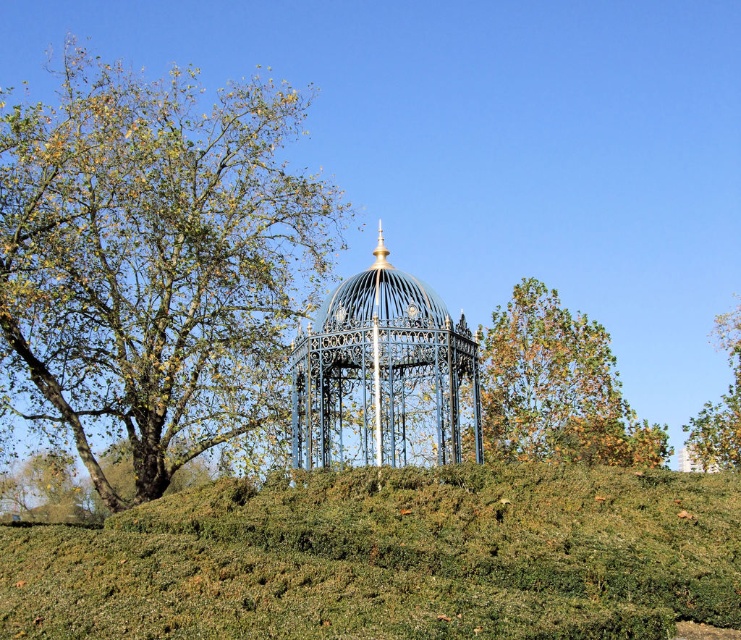
Question: Does green leafy tree at left appear under yellow-green foliage at right?

Choices:
 (A) no
 (B) yes

Answer: (A)

Question: Which is nearer to the yellow-green foliage at right?

Choices:
 (A) green leafy tree at left
 (B) green leafy tree at upper right
 (C) green grassy hill at center
 (D) blue wrought iron gazebo at center

Answer: (D)

Question: Does green leafy tree at left have a greater width compared to blue wrought iron gazebo at center?

Choices:
 (A) no
 (B) yes

Answer: (B)

Question: Considering the real-world distances, which object is farthest from the green leafy tree at left?

Choices:
 (A) yellow-green foliage at right
 (B) green grassy hill at center

Answer: (B)

Question: From the image, what is the correct spatial relationship of green grassy hill at center in relation to green leafy tree at upper right?

Choices:
 (A) above
 (B) below

Answer: (B)

Question: Which point appears closest to the camera in this image?

Choices:
 (A) (156, 344)
 (B) (541, 333)
 (C) (127, 634)
 (D) (338, 328)

Answer: (C)